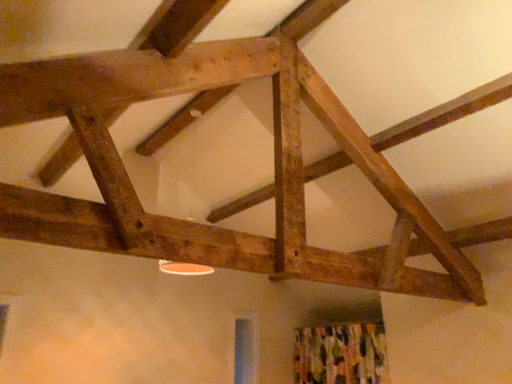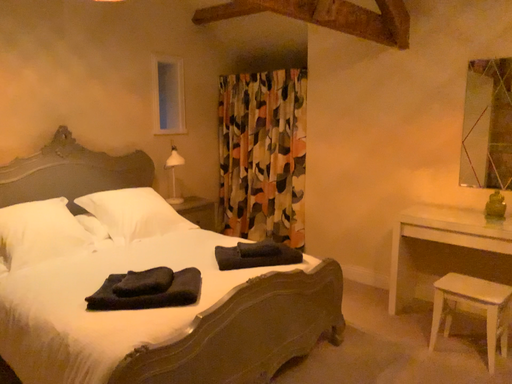
Question: Which way did the camera rotate in the video?

Choices:
 (A) rotated right
 (B) rotated left

Answer: (A)